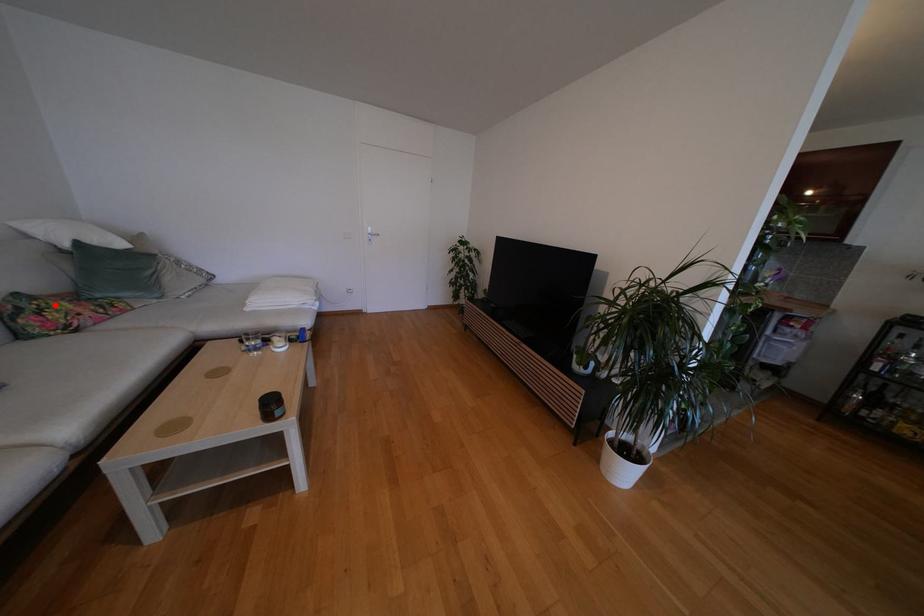
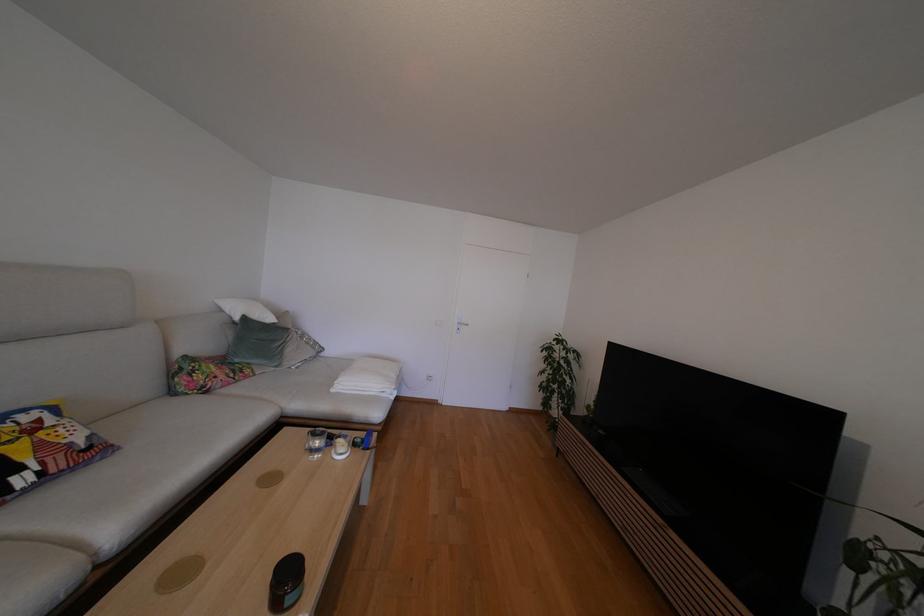
Question: I am providing you with two images of the same scene from different viewpoints. A red point is marked on the first image. Is the red point's position out of view in image 2?

Choices:
 (A) Yes
 (B) No

Answer: (B)